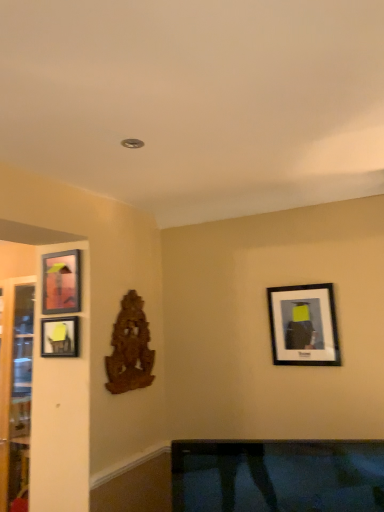
Question: Is wooden carving at center-left positioned far away from matte black picture frame at upper right, the 3th picture frame viewed from the left?

Choices:
 (A) no
 (B) yes

Answer: (A)

Question: Does wooden carving at center-left lie in front of matte black picture frame at upper right, which is the first picture frame from right to left?

Choices:
 (A) yes
 (B) no

Answer: (B)

Question: From a real-world perspective, does wooden carving at center-left stand above matte black picture frame at upper right, which is the first picture frame from right to left?

Choices:
 (A) no
 (B) yes

Answer: (A)

Question: Is matte black picture frame at upper right, the 3th picture frame viewed from the left, a part of wooden carving at center-left?

Choices:
 (A) yes
 (B) no

Answer: (B)

Question: Does wooden carving at center-left have a lesser height compared to matte black picture frame at upper right, which is the first picture frame from right to left?

Choices:
 (A) yes
 (B) no

Answer: (B)

Question: Do you think transparent glass door at left is within matte black picture frame at left, arranged as the 2th picture frame when viewed from the right, or outside of it?

Choices:
 (A) outside
 (B) inside

Answer: (A)

Question: Does point (23, 296) appear closer or farther from the camera than point (59, 339)?

Choices:
 (A) closer
 (B) farther

Answer: (B)

Question: Considering the positions of transparent glass door at left and matte black picture frame at left, the 2th picture frame from the left, in the image, is transparent glass door at left wider or thinner than matte black picture frame at left, the 2th picture frame from the left,?

Choices:
 (A) thin
 (B) wide

Answer: (B)

Question: Based on their positions, is transparent glass door at left located to the left or right of matte black picture frame at left, arranged as the 2th picture frame when viewed from the right?

Choices:
 (A) right
 (B) left

Answer: (B)

Question: From their relative heights in the image, would you say matte black picture frame at upper right, which is the first picture frame from right to left, is taller or shorter than matte black picture frame at left, acting as the 3th picture frame starting from the right?

Choices:
 (A) tall
 (B) short

Answer: (A)

Question: Considering the positions of matte black picture frame at upper right, which is the first picture frame from right to left, and matte black picture frame at left, acting as the 3th picture frame starting from the right, in the image, is matte black picture frame at upper right, which is the first picture frame from right to left, bigger or smaller than matte black picture frame at left, acting as the 3th picture frame starting from the right,?

Choices:
 (A) big
 (B) small

Answer: (A)

Question: From the image's perspective, relative to matte black picture frame at left, marked as the first picture frame in a left-to-right arrangement, is matte black picture frame at upper right, the 3th picture frame viewed from the left, above or below?

Choices:
 (A) above
 (B) below

Answer: (B)

Question: Is matte black picture frame at upper right, the 3th picture frame viewed from the left, in front of or behind matte black picture frame at left, marked as the first picture frame in a left-to-right arrangement, in the image?

Choices:
 (A) behind
 (B) front

Answer: (A)

Question: In the image, is wooden carving at center-left positioned in front of or behind transparent glass door at left?

Choices:
 (A) behind
 (B) front

Answer: (B)

Question: From their relative heights in the image, would you say wooden carving at center-left is taller or shorter than transparent glass door at left?

Choices:
 (A) short
 (B) tall

Answer: (A)